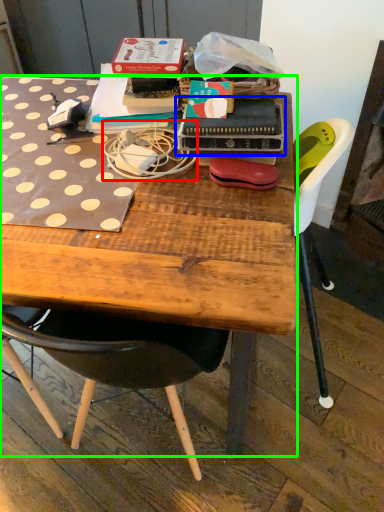
Question: Which object is positioned closest to string (highlighted by a red box)? Select from paperback book (highlighted by a blue box) and desk (highlighted by a green box).

Choices:
 (A) paperback book
 (B) desk

Answer: (A)